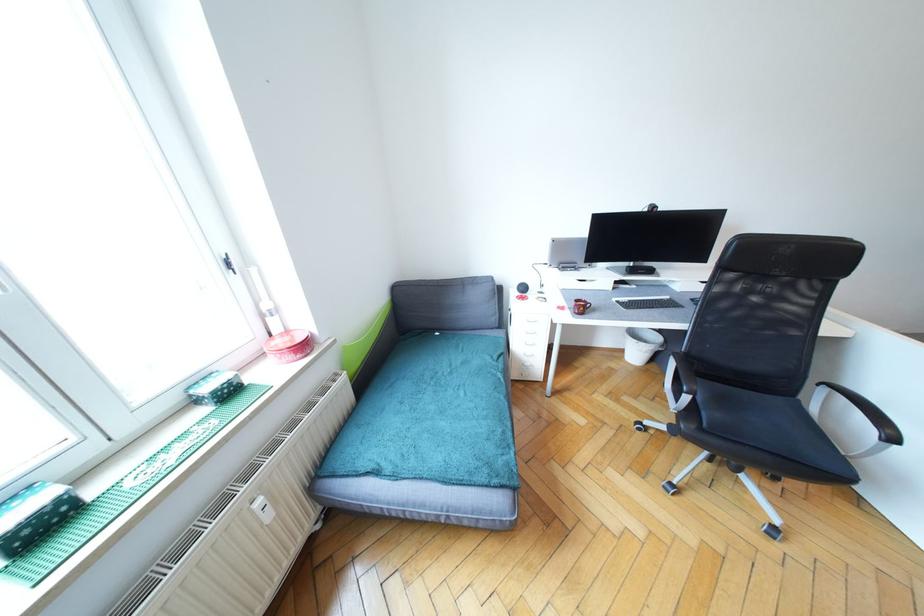
At what (x,y) coordinates should I click in order to perform the action: click on white trash can. Please return your answer as a coordinate pair (x, y). Looking at the image, I should click on pos(640,345).